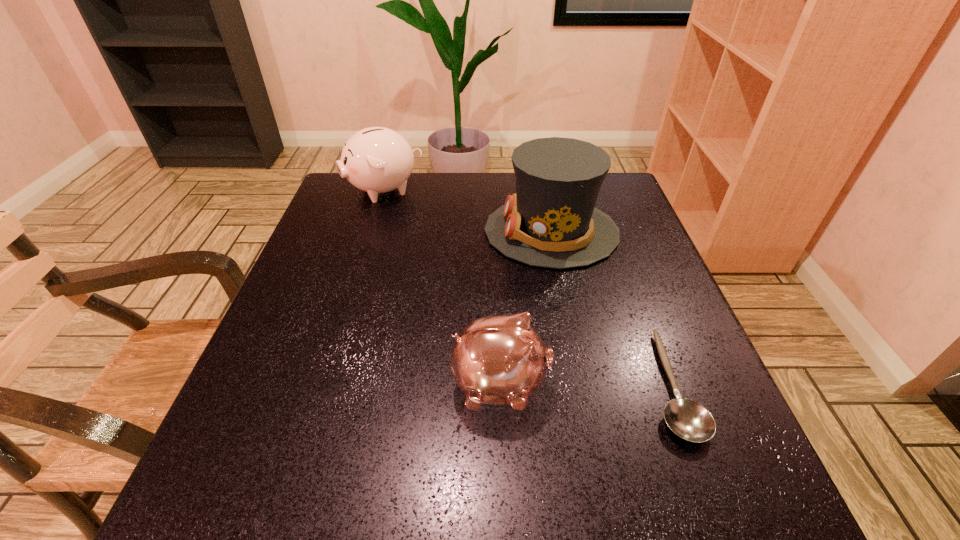
At what (x,y) coordinates should I click in order to perform the action: click on dress hat. Please return your answer as a coordinate pair (x, y). Image resolution: width=960 pixels, height=540 pixels. Looking at the image, I should click on (551, 221).

You are a GUI agent. You are given a task and a screenshot of the screen. Output one action in this format:
    pyautogui.click(x=<x>, y=<y>)
    Task: Click on the left piggy bank
    This screenshot has height=540, width=960.
    Given the screenshot: What is the action you would take?
    pyautogui.click(x=376, y=160)

Locate an element on the screen. the taller piggy bank is located at coordinates (376, 160).

Where is `the nearer piggy bank`? The width and height of the screenshot is (960, 540). the nearer piggy bank is located at coordinates (499, 359).

Find the location of a particular element. the shorter piggy bank is located at coordinates (499, 359).

The image size is (960, 540). Identify the location of ladle. (688, 419).

The image size is (960, 540). I want to click on vacant space located 0.060m with goggles on the front of the dress hat, so click(x=460, y=232).

Image resolution: width=960 pixels, height=540 pixels. Find the location of `free space located with goggles on the front of the dress hat`. free space located with goggles on the front of the dress hat is located at coordinates (386, 232).

What are the coordinates of `free region located 0.380m with goggles on the front of the dress hat` in the screenshot? It's located at (329, 232).

The width and height of the screenshot is (960, 540). Identify the location of free space located on the right of the left piggy bank. (441, 190).